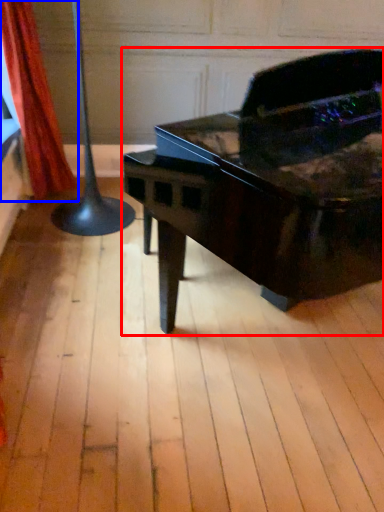
Question: Which object is closer to the camera taking this photo, piano (highlighted by a red box) or curtain (highlighted by a blue box)?

Choices:
 (A) piano
 (B) curtain

Answer: (A)